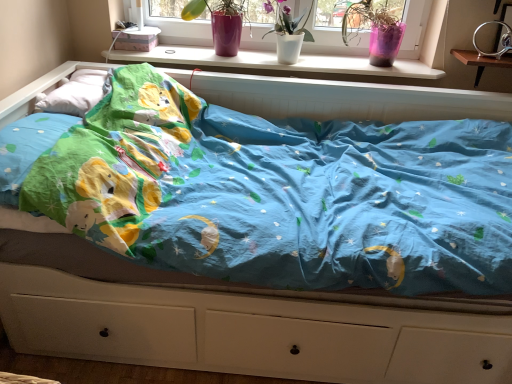
Question: From the image's perspective, does white soft pillow at upper left appear lower than white plastic window sill at upper center?

Choices:
 (A) no
 (B) yes

Answer: (B)

Question: Considering the relative sizes of white soft pillow at upper left and white plastic window sill at upper center in the image provided, is white soft pillow at upper left thinner than white plastic window sill at upper center?

Choices:
 (A) yes
 (B) no

Answer: (A)

Question: Is white soft pillow at upper left facing away from white plastic window sill at upper center?

Choices:
 (A) yes
 (B) no

Answer: (B)

Question: From the image's perspective, is white soft pillow at upper left above white plastic window sill at upper center?

Choices:
 (A) yes
 (B) no

Answer: (B)

Question: Could you tell me if white soft pillow at upper left is facing white plastic window sill at upper center?

Choices:
 (A) yes
 (B) no

Answer: (A)

Question: Can you confirm if white soft pillow at upper left is bigger than white plastic window sill at upper center?

Choices:
 (A) no
 (B) yes

Answer: (A)

Question: From the image's perspective, is pink plastic pot at upper right, which is the first floral arrangement from right to left, beneath white matte vase at upper center, arranged as the 2th floral arrangement when viewed from the left?

Choices:
 (A) yes
 (B) no

Answer: (B)

Question: Is the position of pink plastic pot at upper right, marked as the 3th floral arrangement in a left-to-right arrangement, less distant than that of white matte vase at upper center, arranged as the 2th floral arrangement when viewed from the left?

Choices:
 (A) no
 (B) yes

Answer: (A)

Question: Can you confirm if pink plastic pot at upper right, which is the first floral arrangement from right to left, is smaller than white matte vase at upper center, arranged as the 2th floral arrangement when viewed from the left?

Choices:
 (A) no
 (B) yes

Answer: (A)

Question: Is pink plastic pot at upper right, which is the first floral arrangement from right to left, to the left of white matte vase at upper center, arranged as the 2th floral arrangement when viewed from the left, from the viewer's perspective?

Choices:
 (A) yes
 (B) no

Answer: (B)

Question: Are pink plastic pot at upper right, marked as the 3th floral arrangement in a left-to-right arrangement, and white matte vase at upper center, arranged as the 2th floral arrangement when viewed from the left, making contact?

Choices:
 (A) no
 (B) yes

Answer: (A)

Question: From a real-world perspective, is pink plastic pot at upper right, which is the first floral arrangement from right to left, on white matte vase at upper center, which is counted as the 2th floral arrangement, starting from the right?

Choices:
 (A) no
 (B) yes

Answer: (B)

Question: Is matte pink vase at upper center, the third floral arrangement from the right, taller than wooden changing table at upper right?

Choices:
 (A) yes
 (B) no

Answer: (A)